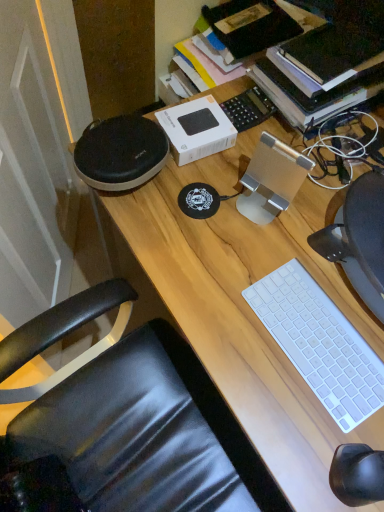
The width and height of the screenshot is (384, 512). Describe the element at coordinates (320, 343) in the screenshot. I see `white plastic keyboard at lower right` at that location.

The height and width of the screenshot is (512, 384). Identify the location of white plastic keyboard at lower right. (320, 343).

Describe the element at coordinates (239, 307) in the screenshot. I see `wooden desk at center` at that location.

Where is `wooden desk at center`? The image size is (384, 512). wooden desk at center is located at coordinates (239, 307).

Where is `white plastic keyboard at lower right`? white plastic keyboard at lower right is located at coordinates (320, 343).

In the image, is wooden desk at center on the left side or the right side of white plastic keyboard at lower right?

In the image, wooden desk at center appears on the right side of white plastic keyboard at lower right.

Which object is further away from the camera taking this photo, wooden desk at center or white plastic keyboard at lower right?

Positioned behind is white plastic keyboard at lower right.

Which is nearer, [380,410] or [303,332]?

Point [380,410]

From the image's perspective, is wooden desk at center located above white plastic keyboard at lower right?

Actually, wooden desk at center appears below white plastic keyboard at lower right in the image.

From a real-world perspective, is wooden desk at center physically located above or below white plastic keyboard at lower right?

From a real-world perspective, wooden desk at center is physically below white plastic keyboard at lower right.

Is wooden desk at center wider or thinner than white plastic keyboard at lower right?

In the image, wooden desk at center appears to be wider than white plastic keyboard at lower right.

Does wooden desk at center have a lesser height compared to white plastic keyboard at lower right?

No, wooden desk at center is not shorter than white plastic keyboard at lower right.

In the scene shown: Looking at the image, does wooden desk at center seem bigger or smaller compared to white plastic keyboard at lower right?

Clearly, wooden desk at center is larger in size than white plastic keyboard at lower right.

Would you say wooden desk at center contains white plastic keyboard at lower right?

Yes, white plastic keyboard at lower right can be found within wooden desk at center.

Is wooden desk at center not close to white plastic keyboard at lower right?

No, there isn't a large distance between wooden desk at center and white plastic keyboard at lower right.

In the scene shown: Is wooden desk at center positioned with its back to white plastic keyboard at lower right?

No.

Where is `computer keyboard above the wooden desk at center (from the image's perspective)`? The width and height of the screenshot is (384, 512). computer keyboard above the wooden desk at center (from the image's perspective) is located at coordinates (320, 343).

Is white plastic keyboard at lower right at the right side of wooden desk at center?

No.

In the scene shown: Is the depth of white plastic keyboard at lower right greater than that of wooden desk at center?

Yes, white plastic keyboard at lower right is behind wooden desk at center.

Looking at this image, which point is more forward, (351, 381) or (309, 202)?

Point (351, 381)

From the image's perspective, which object appears higher, white plastic keyboard at lower right or wooden desk at center?

white plastic keyboard at lower right appears higher in the image.

From a real-world perspective, between white plastic keyboard at lower right and wooden desk at center, who is vertically lower?

wooden desk at center is physically lower.

In the scene shown: Considering the sizes of white plastic keyboard at lower right and wooden desk at center in the image, is white plastic keyboard at lower right wider or thinner than wooden desk at center?

Considering their sizes, white plastic keyboard at lower right looks slimmer than wooden desk at center.

Can you confirm if white plastic keyboard at lower right is shorter than wooden desk at center?

Indeed, white plastic keyboard at lower right has a lesser height compared to wooden desk at center.

Which of these two, white plastic keyboard at lower right or wooden desk at center, is bigger?

With larger size is wooden desk at center.

Which is correct: white plastic keyboard at lower right is inside wooden desk at center, or outside of it?

white plastic keyboard at lower right exists entirely within wooden desk at center.

Are white plastic keyboard at lower right and wooden desk at center located far from each other?

They are positioned close to each other.

Is white plastic keyboard at lower right facing towards wooden desk at center?

No.

What are the coordinates of `desk below the white plastic keyboard at lower right (from the image's perspective)` in the screenshot? It's located at (239, 307).

Where is `desk located below the white plastic keyboard at lower right (from the image's perspective)`? This screenshot has width=384, height=512. desk located below the white plastic keyboard at lower right (from the image's perspective) is located at coordinates (239, 307).

In the image, there is a white plastic keyboard at lower right. At what (x,y) coordinates should I click in order to perform the action: click on desk below it (from a real-world perspective). Please return your answer as a coordinate pair (x, y). Looking at the image, I should click on point(239,307).